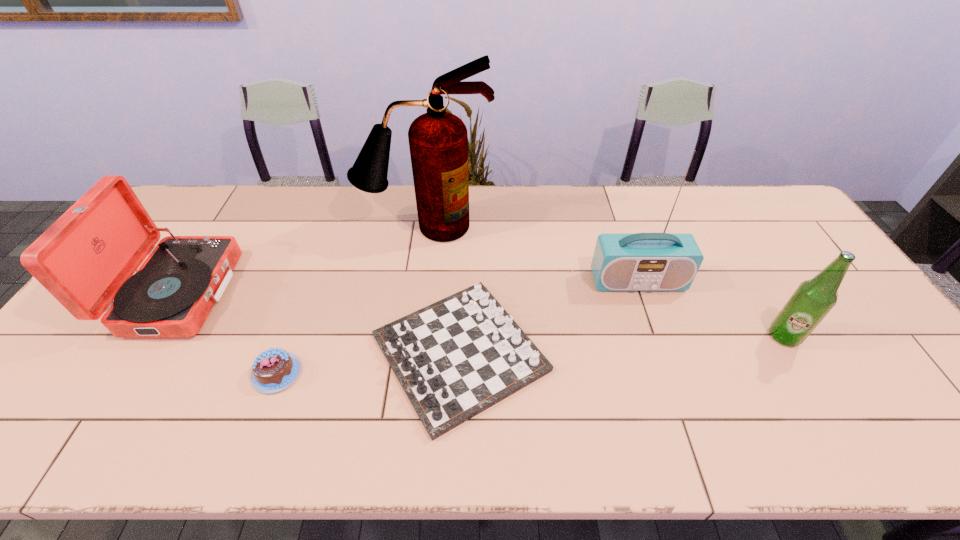
The width and height of the screenshot is (960, 540). In order to click on the tallest object in this screenshot , I will do `click(438, 140)`.

This screenshot has width=960, height=540. I want to click on fire extinguisher, so click(438, 140).

What are the coordinates of `the second tallest object` in the screenshot? It's located at (663, 261).

In order to click on the fifth object from left to right in this screenshot , I will do `click(663, 261)`.

Find the location of `the leftmost object`. the leftmost object is located at coordinates (85, 259).

What are the coordinates of `the rightmost object` in the screenshot? It's located at (813, 299).

The height and width of the screenshot is (540, 960). In order to click on the second shortest object in this screenshot , I will do `click(457, 357)`.

Locate an element on the screen. This screenshot has width=960, height=540. the shortest object is located at coordinates (274, 370).

The width and height of the screenshot is (960, 540). Find the location of `chocolate cake`. chocolate cake is located at coordinates (274, 370).

Where is `vacant region located at the nozzle of the fire extinguisher`? The width and height of the screenshot is (960, 540). vacant region located at the nozzle of the fire extinguisher is located at coordinates (414, 320).